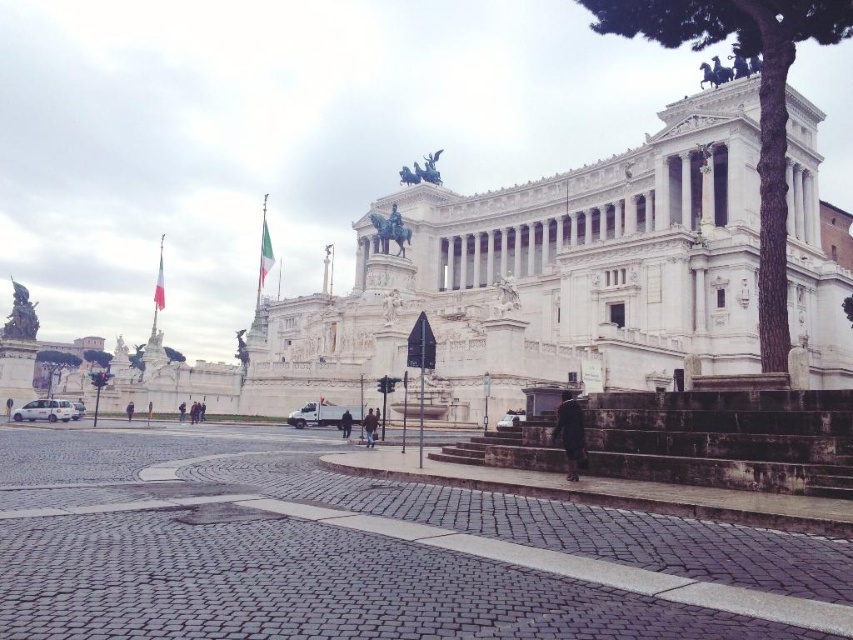
Who is lower down, white marble palace at center or white matte van at lower left?

white matte van at lower left is lower down.

Is white marble palace at center below white matte van at lower left?

Incorrect, white marble palace at center is not positioned below white matte van at lower left.

Does point (706, 259) lie in front of point (70, 410)?

No, (706, 259) is further to viewer.

Locate an element on the screen. white marble palace at center is located at coordinates (544, 275).

This screenshot has height=640, width=853. What do you see at coordinates (366, 552) in the screenshot? I see `cobblestone plaza at center` at bounding box center [366, 552].

Is cobblestone plaza at center positioned in front of white marble palace at center?

Yes.

Does point (166, 474) come closer to viewer compared to point (287, 333)?

That is True.

Locate an element on the screen. Image resolution: width=853 pixels, height=640 pixels. cobblestone plaza at center is located at coordinates (366, 552).

I want to click on dark stone stairs at center, so click(x=724, y=440).

Does point (648, 458) lie in front of point (317, 420)?

Yes, point (648, 458) is closer to viewer.

Where is `dark stone stairs at center`? The width and height of the screenshot is (853, 640). dark stone stairs at center is located at coordinates (724, 440).